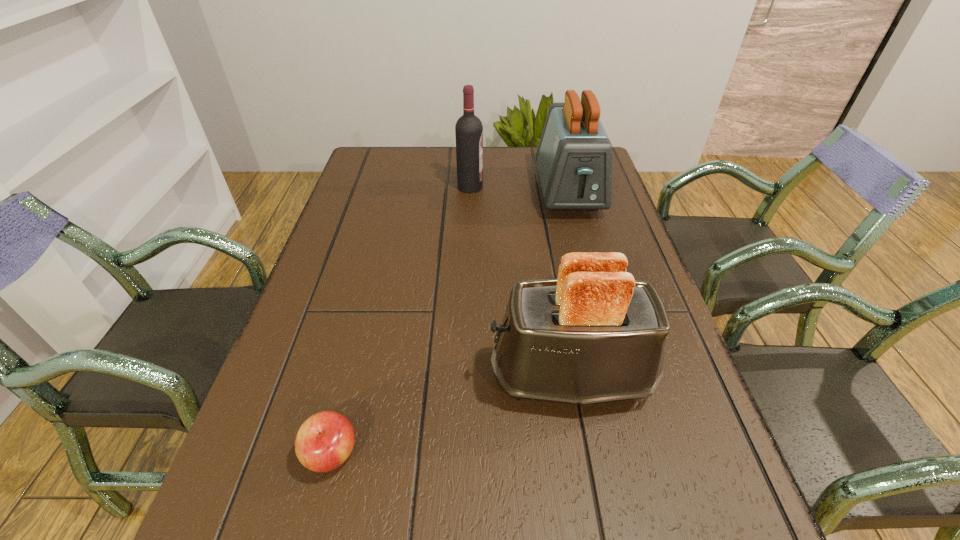
You are a GUI agent. You are given a task and a screenshot of the screen. Output one action in this format:
    pyautogui.click(x=<x>, y=<y>)
    Task: Click on the vacant region that satisfies the following two spatial constraints: 1. on the front-facing side of the farther toaster; 2. on the side of the third farthest object with the control lever
    The height and width of the screenshot is (540, 960).
    Given the screenshot: What is the action you would take?
    pos(618,376)

I want to click on vacant space that satisfies the following two spatial constraints: 1. on the front-facing side of the farther toaster; 2. on the side of the nearer toaster with the control lever, so click(618, 376).